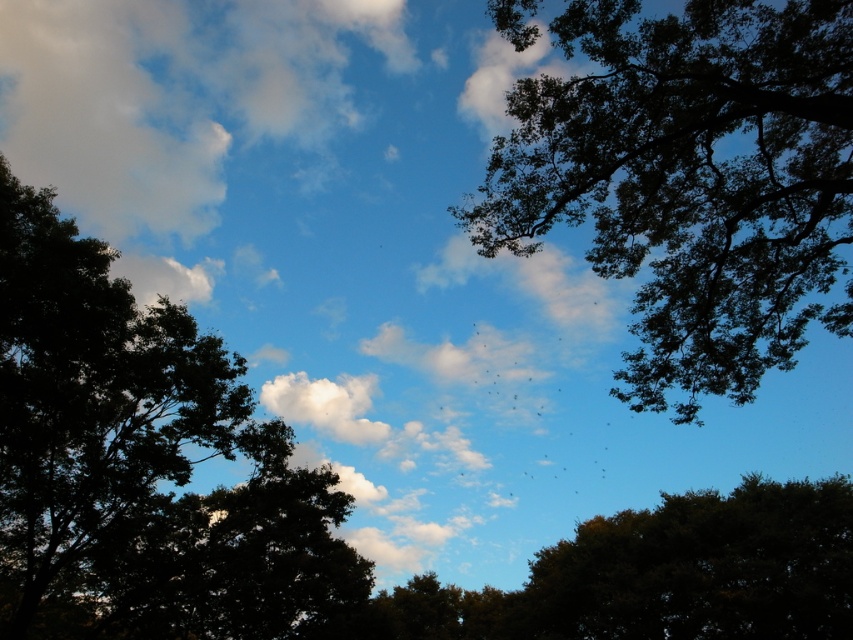
You are an astronomer observing the sky through a telescope. You notice two points of light in the scene, one at point (598,179) and the other at point (775,602). Which point is closer to your telescope lens?

Point (598,179) is closer to the camera than point (775,602), so the point at (598,179) is closer to the telescope lens.

You are an artist trying to paint the scene. You notice two trees in the image. Which tree should you paint smaller to maintain the correct size relationship between the dark green leafy tree at upper right and the green leafy tree at center?

You should paint the dark green leafy tree at upper right smaller than the green leafy tree at center to maintain the correct size relationship.